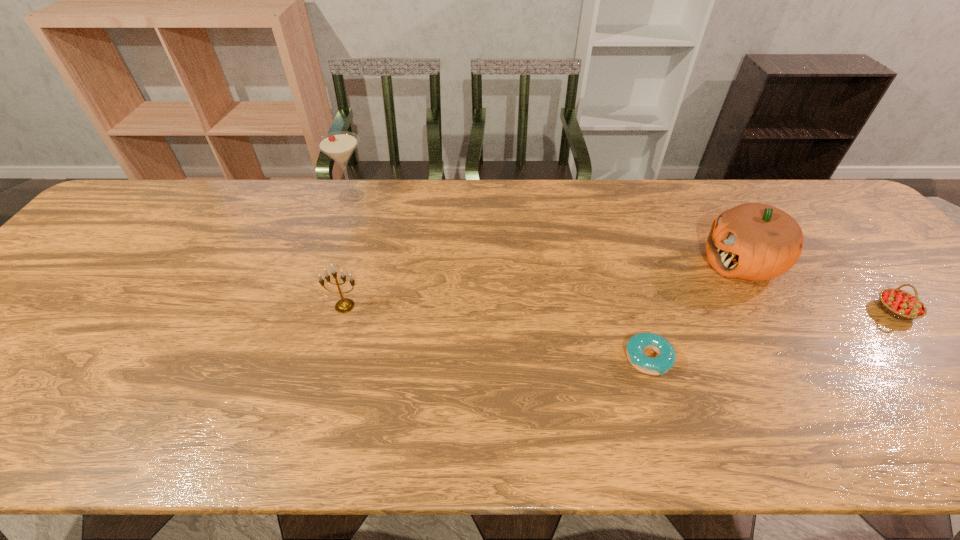
Where is `martini`? martini is located at coordinates (340, 145).

Find the location of a particular element. The image size is (960, 540). the fourth object from left to right is located at coordinates (752, 241).

What are the coordinates of `the fourth nearest object` in the screenshot? It's located at (752, 241).

Locate an element on the screen. The height and width of the screenshot is (540, 960). the third shortest object is located at coordinates (344, 305).

I want to click on strawberry, so click(900, 304).

The image size is (960, 540). Identify the location of the fourth tallest object. (900, 304).

In order to click on the nearest object in this screenshot , I will do `click(658, 365)`.

Where is `doughnut`? doughnut is located at coordinates (658, 365).

Where is `vacant space located on the left of the martini`? vacant space located on the left of the martini is located at coordinates coord(262,196).

The image size is (960, 540). What are the coordinates of `vacant region located 0.080m on the face of the second object from right to left` in the screenshot? It's located at (673, 262).